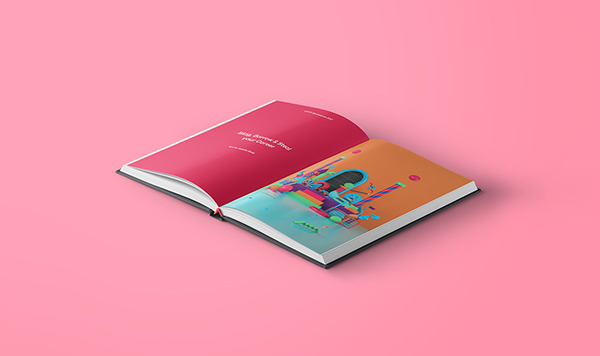
At what (x,y) coordinates should I click in order to perform the action: click on blue floor. Please return your answer as a coordinate pair (x, y). The height and width of the screenshot is (356, 600). Looking at the image, I should click on (277, 215).